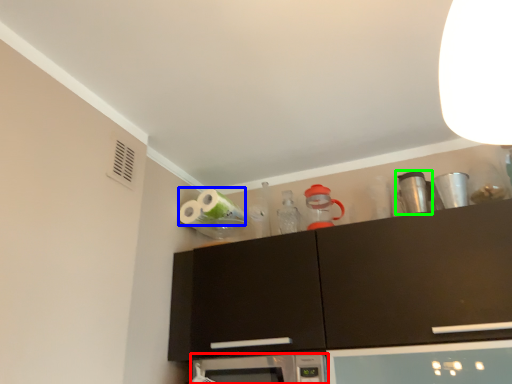
Question: Which is nearer to the microwave oven (highlighted by a red box)? toilet paper (highlighted by a blue box) or appliance (highlighted by a green box).

Choices:
 (A) toilet paper
 (B) appliance

Answer: (A)